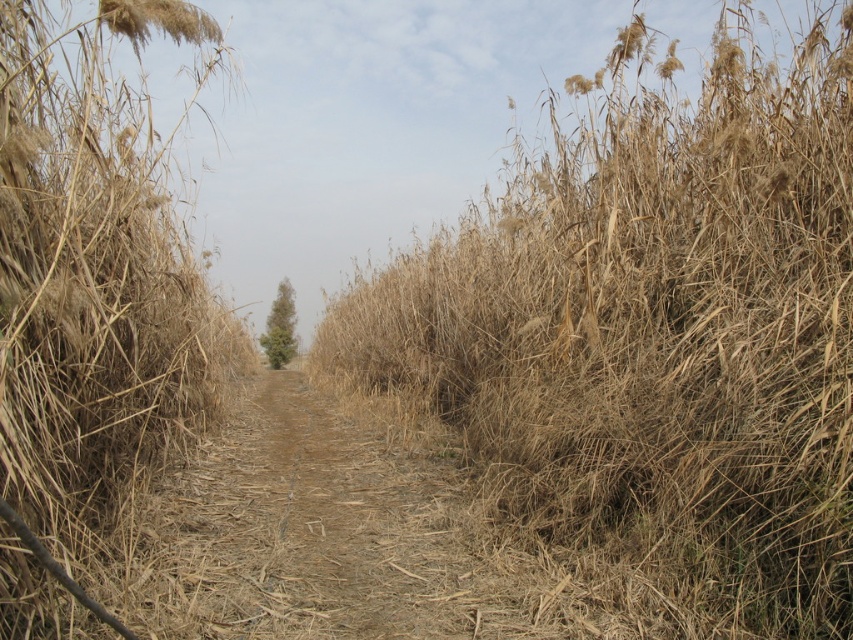
Who is more forward, (79, 134) or (291, 285)?

Point (79, 134) is more forward.

Is point (10, 349) farther from viewer compared to point (280, 324)?

That is False.

In order to click on dry straw at center in this screenshot , I will do `click(91, 275)`.

Is dry grass at center to the right of green leafy tree at center from the viewer's perspective?

Yes, dry grass at center is to the right of green leafy tree at center.

Who is shorter, dry grass at center or green leafy tree at center?

green leafy tree at center is shorter.

Is point (560, 310) positioned after point (281, 296)?

No, (560, 310) is in front of (281, 296).

Where is `dry grass at center`? The height and width of the screenshot is (640, 853). dry grass at center is located at coordinates (654, 339).

Between dry grass at center and dry straw at center, which one appears on the left side from the viewer's perspective?

dry straw at center is more to the left.

Is dry grass at center below dry straw at center?

Incorrect, dry grass at center is not positioned below dry straw at center.

What do you see at coordinates (654, 339) in the screenshot? I see `dry grass at center` at bounding box center [654, 339].

In order to click on dry grass at center in this screenshot , I will do `click(654, 339)`.